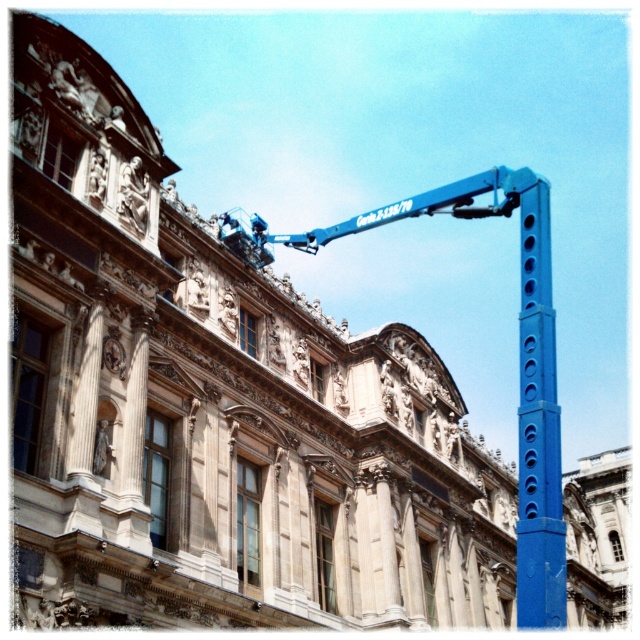
Question: Which point is farther to the camera?

Choices:
 (A) (529, 417)
 (B) (508, 211)

Answer: (B)

Question: Which point is farther to the camera?

Choices:
 (A) blue metallic pole at right
 (B) blue metallic crane at upper center

Answer: (B)

Question: In this image, where is blue metallic crane at upper center located relative to blue metallic pole at right?

Choices:
 (A) right
 (B) left

Answer: (A)

Question: Which point is closer to the camera?

Choices:
 (A) (531, 170)
 (B) (554, 404)

Answer: (B)

Question: Is blue metallic crane at upper center smaller than blue metallic pole at right?

Choices:
 (A) no
 (B) yes

Answer: (A)

Question: Does blue metallic crane at upper center appear over blue metallic pole at right?

Choices:
 (A) yes
 (B) no

Answer: (A)